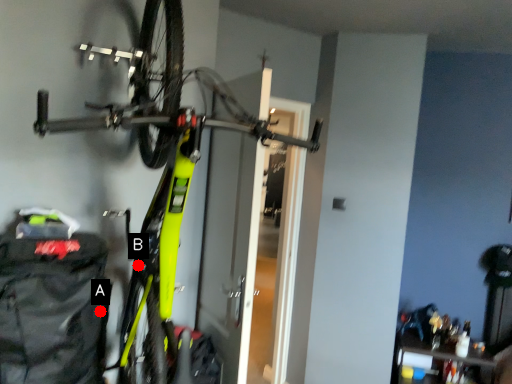
Question: Two points are circled on the image, labeled by A and B beside each circle. Which point is farther from the camera taking this photo?

Choices:
 (A) A is further
 (B) B is further

Answer: (A)